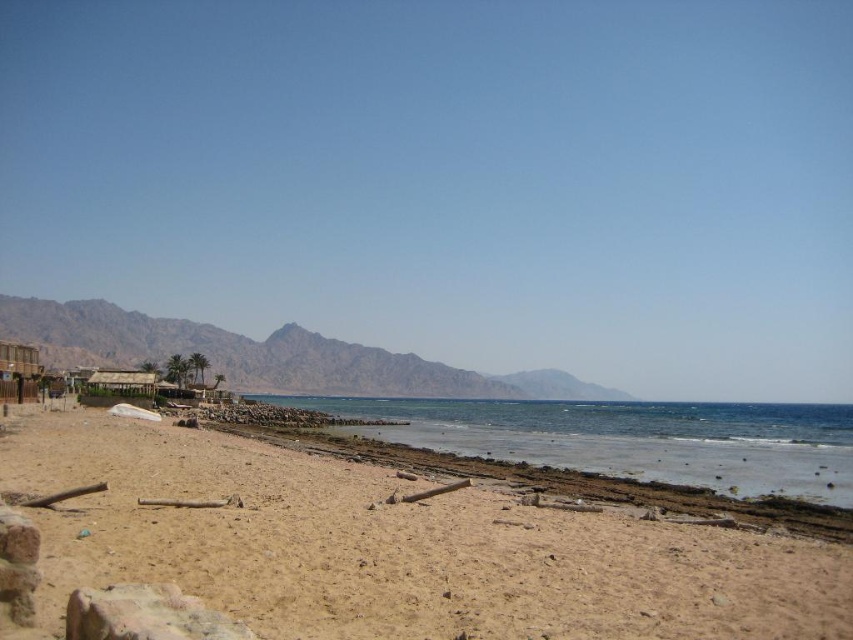
Who is positioned more to the left, clear blue water at lower center or rugged brown mountain at center?

Positioned to the left is rugged brown mountain at center.

Does clear blue water at lower center have a larger size compared to rugged brown mountain at center?

No, clear blue water at lower center is not bigger than rugged brown mountain at center.

Is point (680, 428) positioned in front of point (496, 392)?

Yes.

Where is `clear blue water at lower center`? The width and height of the screenshot is (853, 640). clear blue water at lower center is located at coordinates (628, 438).

Does brown sandy beach at lower center lie behind rugged brown mountain at center?

No, it is not.

Does brown sandy beach at lower center appear under rugged brown mountain at center?

Incorrect, brown sandy beach at lower center is not positioned below rugged brown mountain at center.

This screenshot has height=640, width=853. I want to click on brown sandy beach at lower center, so click(x=393, y=548).

This screenshot has height=640, width=853. In order to click on brown sandy beach at lower center in this screenshot , I will do `click(393, 548)`.

Does brown sandy beach at lower center appear on the right side of clear blue water at lower center?

In fact, brown sandy beach at lower center is to the left of clear blue water at lower center.

Is point (119, 456) closer to viewer compared to point (409, 408)?

Yes.

Find the location of a particular element. brown sandy beach at lower center is located at coordinates (393, 548).